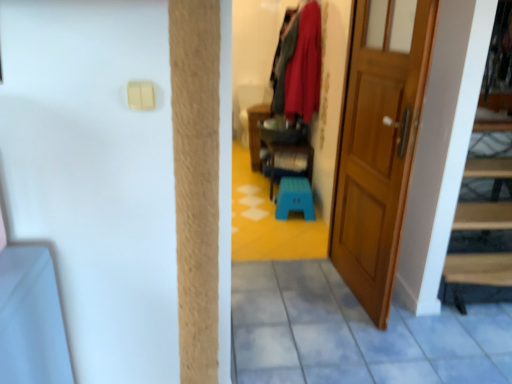
Question: Is wooden door at right positioned beyond the bounds of wooden cabinet at center, arranged as the 1th furniture when viewed from the left?

Choices:
 (A) no
 (B) yes

Answer: (B)

Question: Does wooden door at right have a greater height compared to wooden cabinet at center, arranged as the 1th furniture when viewed from the left?

Choices:
 (A) no
 (B) yes

Answer: (B)

Question: Does wooden door at right come behind wooden cabinet at center, arranged as the 1th furniture when viewed from the left?

Choices:
 (A) yes
 (B) no

Answer: (B)

Question: From the image's perspective, is wooden door at right under wooden cabinet at center, arranged as the 1th furniture when viewed from the left?

Choices:
 (A) yes
 (B) no

Answer: (A)

Question: Would you say wooden door at right contains wooden cabinet at center, positioned as the second furniture in right-to-left order?

Choices:
 (A) yes
 (B) no

Answer: (B)

Question: In terms of size, does velvet red coat at upper center appear bigger or smaller than wooden armchair at center?

Choices:
 (A) small
 (B) big

Answer: (A)

Question: Is point (305, 119) positioned closer to the camera than point (239, 125)?

Choices:
 (A) farther
 (B) closer

Answer: (B)

Question: Considering the positions of velvet red coat at upper center and wooden armchair at center in the image, is velvet red coat at upper center wider or thinner than wooden armchair at center?

Choices:
 (A) thin
 (B) wide

Answer: (A)

Question: Considering the positions of velvet red coat at upper center and wooden armchair at center in the image, is velvet red coat at upper center taller or shorter than wooden armchair at center?

Choices:
 (A) short
 (B) tall

Answer: (B)

Question: In terms of width, does wooden cabinet at center, positioned as the second furniture in right-to-left order, look wider or thinner when compared to wooden door at right?

Choices:
 (A) thin
 (B) wide

Answer: (B)

Question: Considering the positions of wooden cabinet at center, arranged as the 1th furniture when viewed from the left, and wooden door at right in the image, is wooden cabinet at center, arranged as the 1th furniture when viewed from the left, bigger or smaller than wooden door at right?

Choices:
 (A) small
 (B) big

Answer: (A)

Question: Visually, is wooden cabinet at center, positioned as the second furniture in right-to-left order, positioned to the left or to the right of wooden door at right?

Choices:
 (A) left
 (B) right

Answer: (A)

Question: Is wooden cabinet at center, positioned as the second furniture in right-to-left order, in front of or behind wooden door at right in the image?

Choices:
 (A) behind
 (B) front

Answer: (A)

Question: From their relative heights in the image, would you say wooden armchair at center is taller or shorter than teal plastic stool at center, placed as the second furniture when sorted from left to right?

Choices:
 (A) tall
 (B) short

Answer: (A)

Question: Based on their sizes in the image, would you say wooden armchair at center is bigger or smaller than teal plastic stool at center, marked as the 1th furniture in a right-to-left arrangement?

Choices:
 (A) small
 (B) big

Answer: (B)